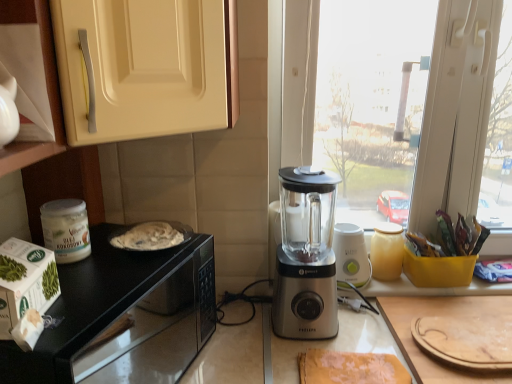
Question: Is satin silver blender at center, marked as the first blender in a back-to-front arrangement, spatially inside matte cream cabinet at upper left, marked as the second cabinetry in a front-to-back arrangement, or outside of it?

Choices:
 (A) outside
 (B) inside

Answer: (A)

Question: Looking at the image, does satin silver blender at center, marked as the first blender in a back-to-front arrangement, seem bigger or smaller compared to matte cream cabinet at upper left, positioned as the 2th cabinetry in left-to-right order?

Choices:
 (A) big
 (B) small

Answer: (B)

Question: Considering the real-world distances, which object is closest to the white cardboard box at left?

Choices:
 (A) matte cream cabinet at upper left, positioned as the 2th cabinetry in left-to-right order
 (B) yellow fabric at lower center
 (C) white matte cabinet at upper left, which is counted as the first cabinetry, starting from the front
 (D) white glossy jar at left
 (E) satin silver blender at center, which is the second blender from left to right

Answer: (D)

Question: Estimate the real-world distances between objects in this image. Which object is farther from the black glossy microwave at lower left?

Choices:
 (A) satin silver blender at center, which is the 1th blender from right to left
 (B) matte cream cabinet at upper left, marked as the second cabinetry in a front-to-back arrangement
 (C) white cardboard box at left
 (D) satin silver blender at center, which is the 1th blender from front to back
 (E) yellow fabric at lower center

Answer: (A)